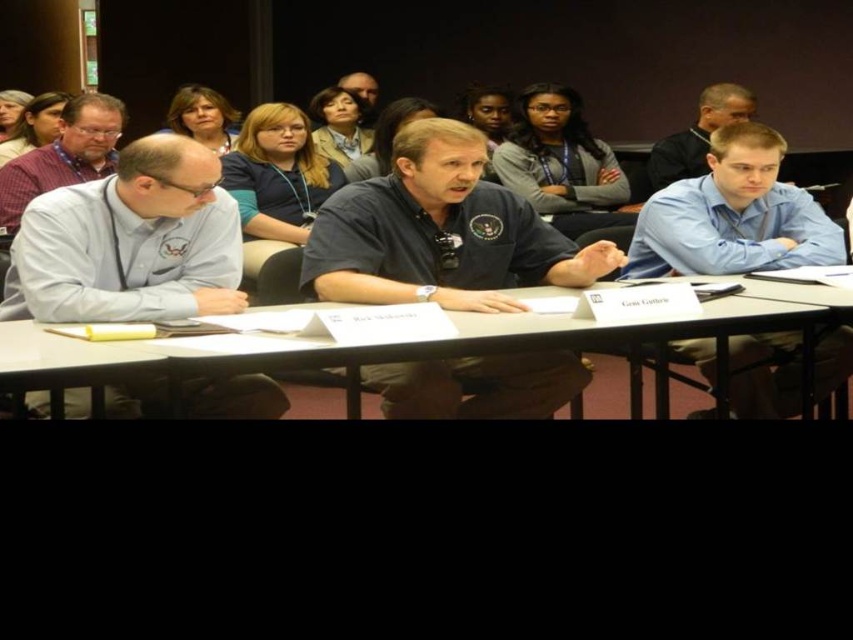
You are attending a conference and need to locate two participants wearing light blue shirt at left and blue shirt at right. Which participant is sitting lower in the image?

The light blue shirt at left is sitting lower in the image because it is positioned below the blue shirt at right.

You are a photographer positioned behind the central speaker. You need to capture a photo of the matte purple shirt at left without including the white plastic table at center in the frame. Is this possible based on their positions?

The white plastic table at center is in front of matte purple shirt at left, so the table would block the view of the matte purple shirt at left. Therefore, it is not possible to take a photo of the matte purple shirt at left without including the white plastic table at center in the frame.